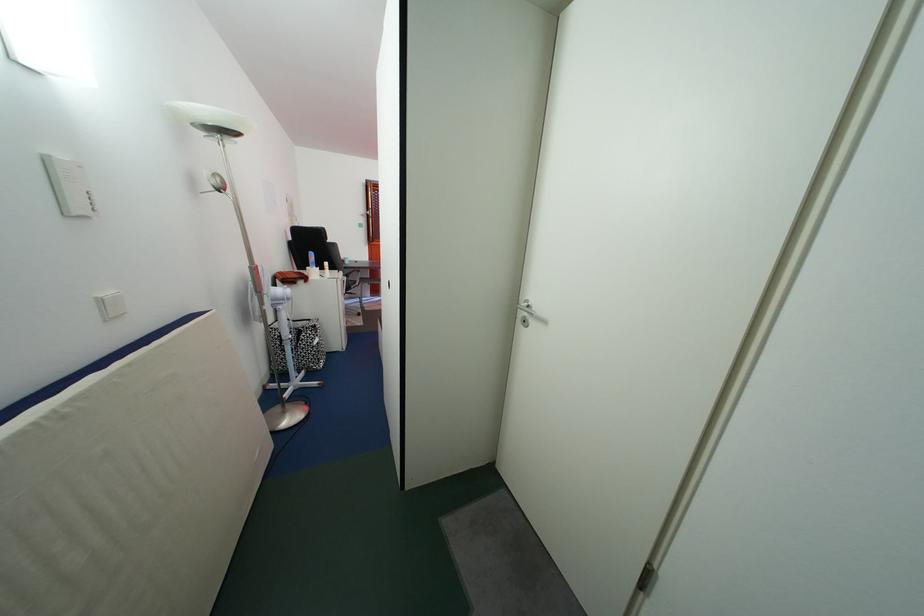
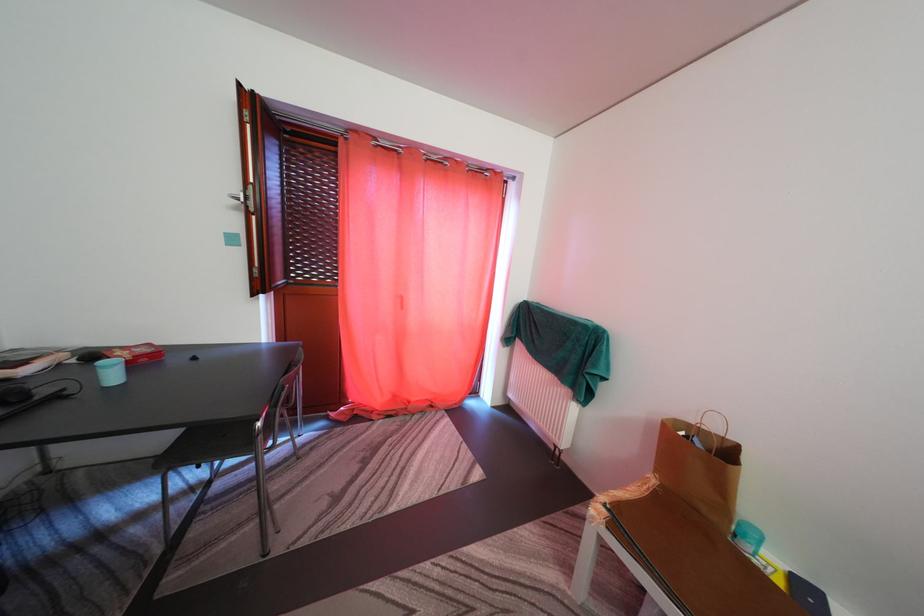
Question: The images are taken continuously from a first-person perspective. In which direction are you moving?

Choices:
 (A) Left
 (B) Right
 (C) Forward
 (D) Backward

Answer: (C)